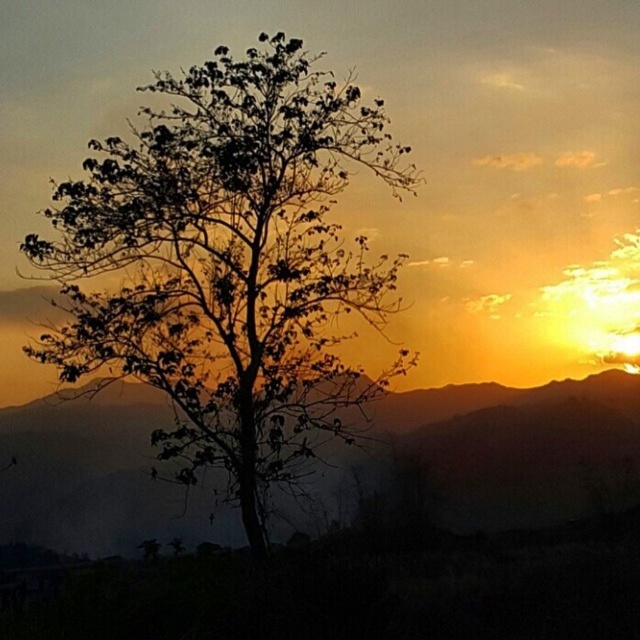
You are an astronomer observing the sunset scene. You notice a point at coordinates (228, 264). What object does this point correspond to in the scene?

The point at coordinates (228, 264) corresponds to the silhouette leafy tree at center.

You are an artist trying to sketch the sunset scene. You need to decide the placement of the silhouette leafy tree at center and the silky orange mountain at center. Based on their sizes, which one should you draw first to ensure proper scaling?

The silhouette leafy tree at center is smaller than the silky orange mountain at center, so you should draw the silky orange mountain at center first to establish the larger structure before adding the smaller tree.